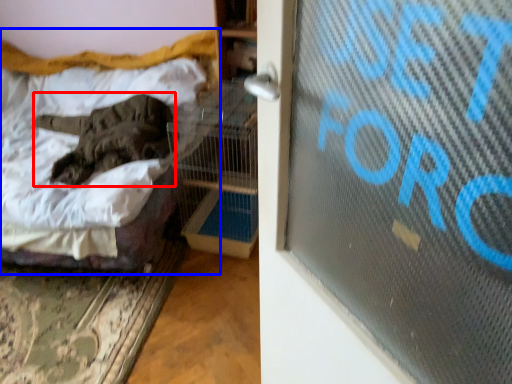
Question: Which object is closer to the camera taking this photo, animal (highlighted by a red box) or bed (highlighted by a blue box)?

Choices:
 (A) animal
 (B) bed

Answer: (B)